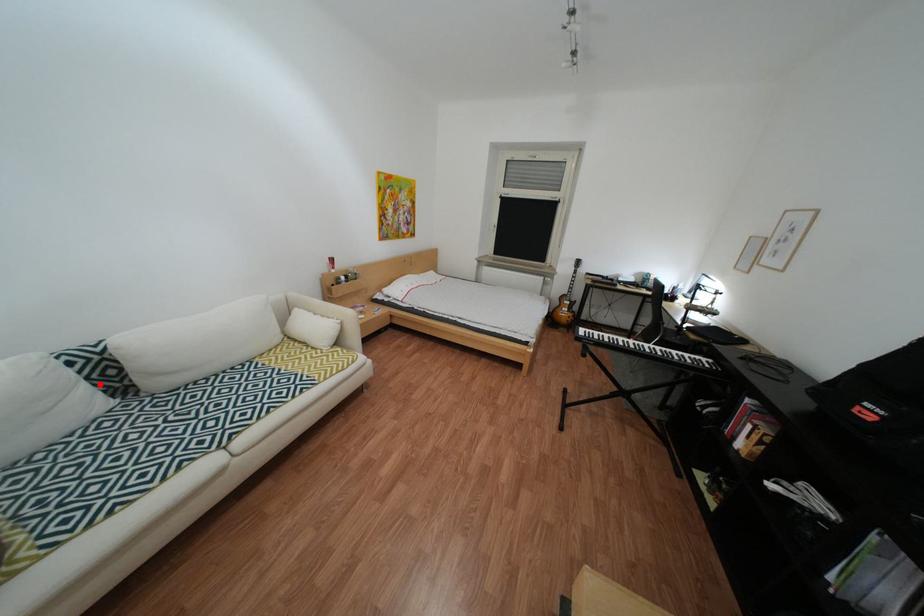
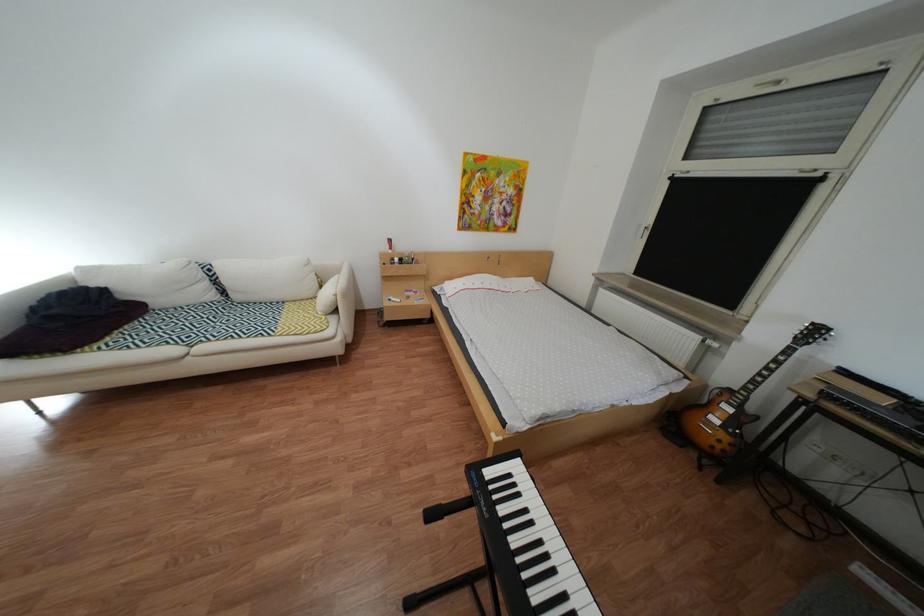
Question: I am providing you with two images of the same scene from different viewpoints. A red point is shown in image1. For the corresponding object point in image2, is it positioned nearer or farther from the camera?

Choices:
 (A) Nearer
 (B) Farther

Answer: (A)